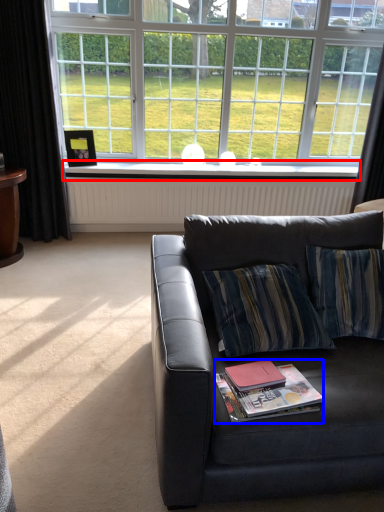
Question: Which object is closer to the camera taking this photo, window sill (highlighted by a red box) or magazine (highlighted by a blue box)?

Choices:
 (A) window sill
 (B) magazine

Answer: (B)